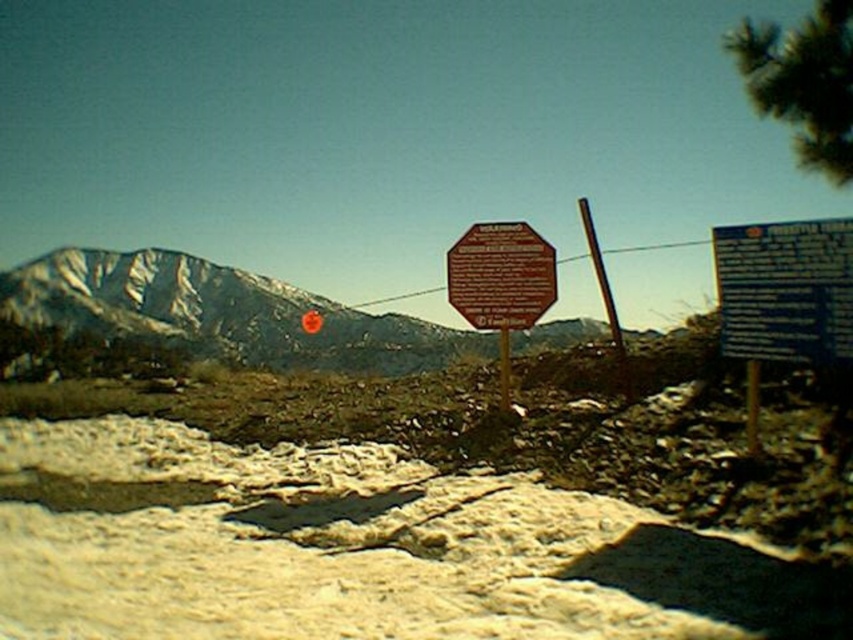
Question: Is red plastic sign at center in front of metallic pole at center?

Choices:
 (A) yes
 (B) no

Answer: (A)

Question: In this image, where is snowy rocky mountain at center located relative to metallic pole at center?

Choices:
 (A) right
 (B) left

Answer: (B)

Question: Which point is closer to the camera?

Choices:
 (A) (750, 404)
 (B) (512, 326)
 (C) (828, 230)
 (D) (505, 401)

Answer: (C)

Question: Among these objects, which one is farthest from the camera?

Choices:
 (A) brown wooden sign at center
 (B) metallic pole at center-right
 (C) green textured pine at upper right

Answer: (A)

Question: Which of the following is the farthest from the observer?

Choices:
 (A) metallic pole at center
 (B) red plastic sign at center
 (C) brown wooden sign at center

Answer: (A)

Question: Does green textured pine at upper right come behind brown wooden sign at center?

Choices:
 (A) yes
 (B) no

Answer: (B)